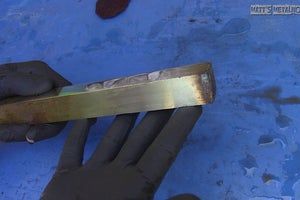
I want to click on picture label, so click(x=260, y=7).